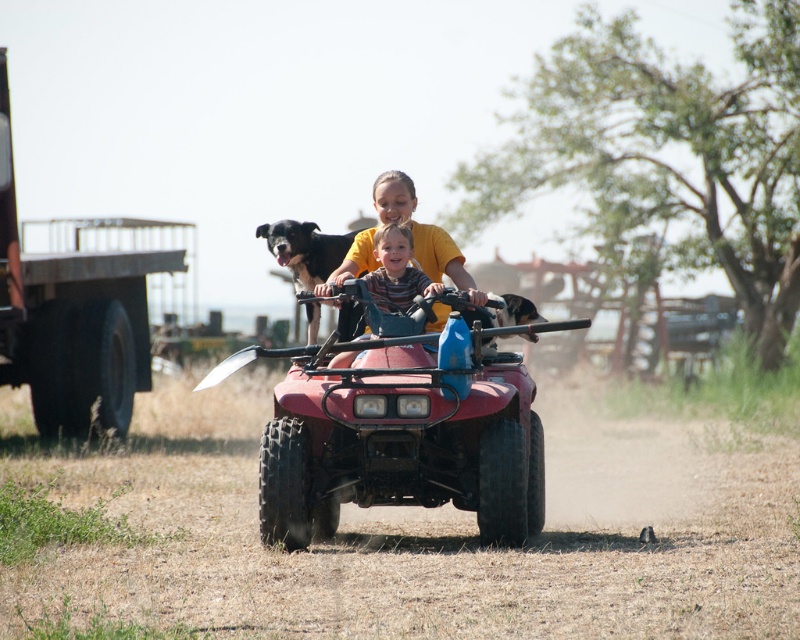
Does dusty terrain at center appear on the left side of black fur dog at upper center?

No, dusty terrain at center is not to the left of black fur dog at upper center.

Does dusty terrain at center have a greater width compared to black fur dog at upper center?

Yes.

Who is more forward, (340, 605) or (312, 248)?

Point (340, 605) is in front.

The image size is (800, 640). In order to click on dusty terrain at center in this screenshot , I will do `click(420, 531)`.

Does black fur dog at upper center have a greater width compared to black fur dog at center?

Incorrect, black fur dog at upper center's width does not surpass black fur dog at center's.

Which is behind, point (344, 257) or point (509, 308)?

Point (344, 257)

Locate an element on the screen. black fur dog at upper center is located at coordinates (304, 250).

Is yellow cotton shirt at center smaller than black fur dog at center?

Correct, yellow cotton shirt at center occupies less space than black fur dog at center.

Based on the photo, between yellow cotton shirt at center and black fur dog at center, which one has more height?

black fur dog at center is taller.

What are the coordinates of `yellow cotton shirt at center` in the screenshot? It's located at (442, 259).